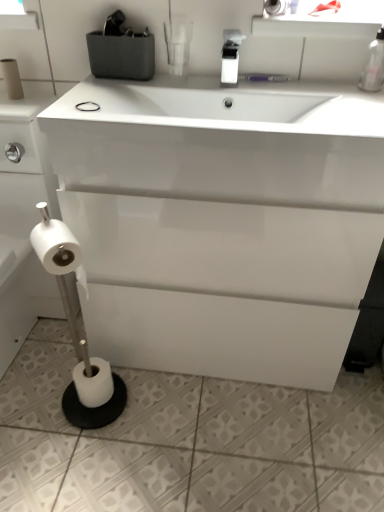
Find the location of a particular element. vacant space situated above white glossy cabinet at center (from a real-world perspective) is located at coordinates (198, 84).